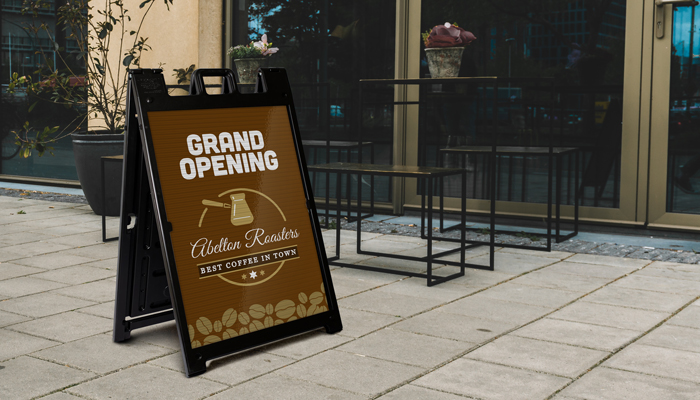
Identify the location of plant pot. This screenshot has width=700, height=400. (94, 153).